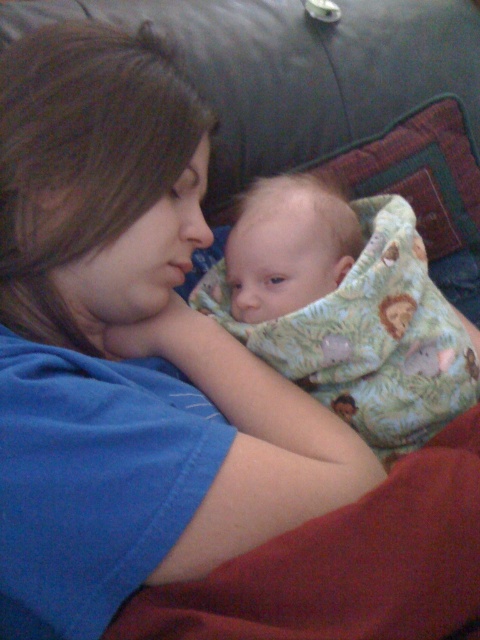
Question: Can you confirm if soft green fabric baby at center is smaller than soft red blanket at lower right?

Choices:
 (A) yes
 (B) no

Answer: (B)

Question: Where is soft green fabric baby at center located in relation to soft red blanket at lower right in the image?

Choices:
 (A) above
 (B) below

Answer: (A)

Question: Which point appears closest to the camera in this image?

Choices:
 (A) (255, 548)
 (B) (237, 310)

Answer: (A)

Question: Observing the image, what is the correct spatial positioning of soft green fabric baby at center in reference to soft red blanket at lower right?

Choices:
 (A) below
 (B) above

Answer: (B)